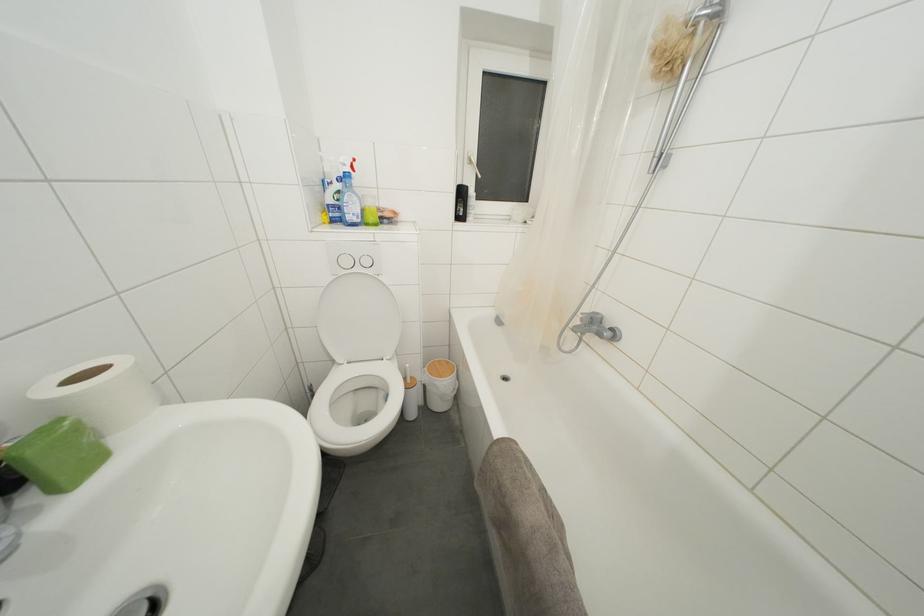
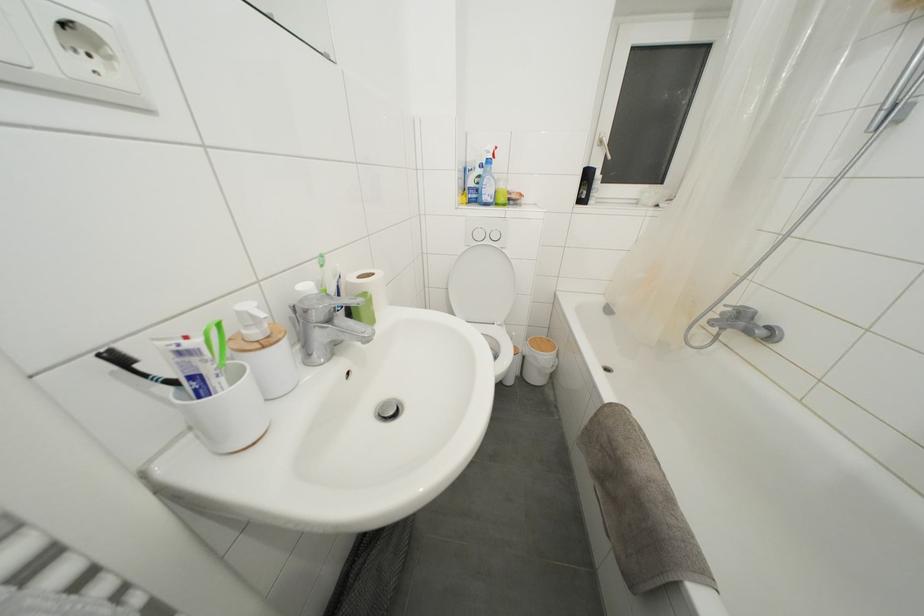
The point at [466,198] is marked in the first image. Where is the corresponding point in the second image?

(591, 180)